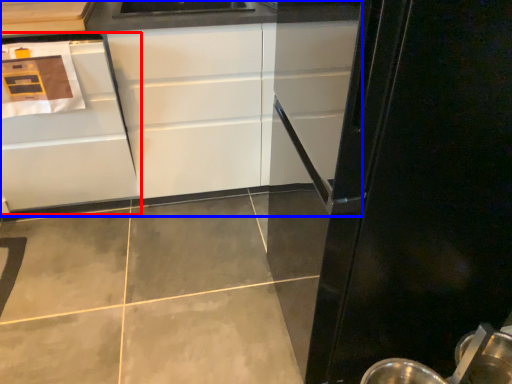
Question: Which point is closer to the camera, cabinetry (highlighted by a red box) or cabinetry (highlighted by a blue box)?

Choices:
 (A) cabinetry
 (B) cabinetry

Answer: (A)